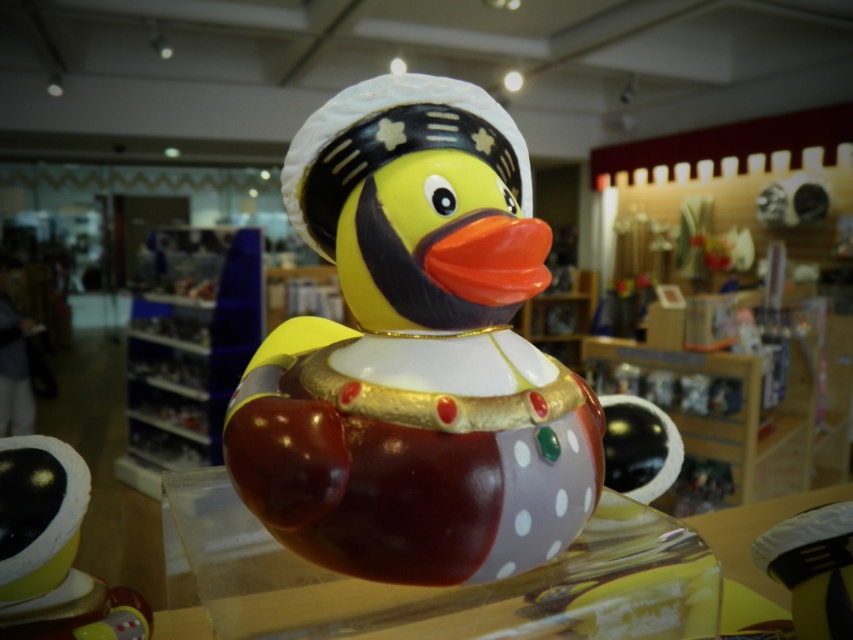
Is point (315, 481) in front of point (47, 605)?

That is True.

Between polished ceramic duck at center and shiny gold duck at center, which one appears on the right side from the viewer's perspective?

Positioned to the right is polished ceramic duck at center.

Describe the element at coordinates (415, 353) in the screenshot. I see `polished ceramic duck at center` at that location.

The image size is (853, 640). What are the coordinates of `polished ceramic duck at center` in the screenshot? It's located at (415, 353).